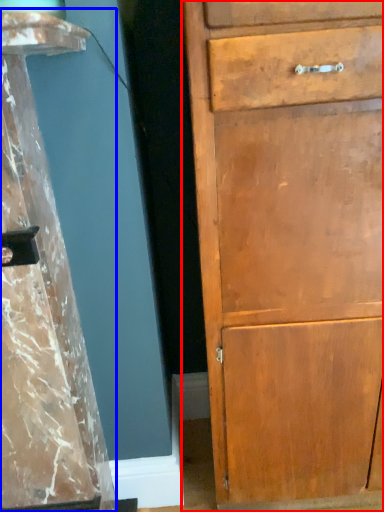
Question: Which of the following is the closest to the observer, chest of drawers (highlighted by a red box) or pillar (highlighted by a blue box)?

Choices:
 (A) chest of drawers
 (B) pillar

Answer: (B)